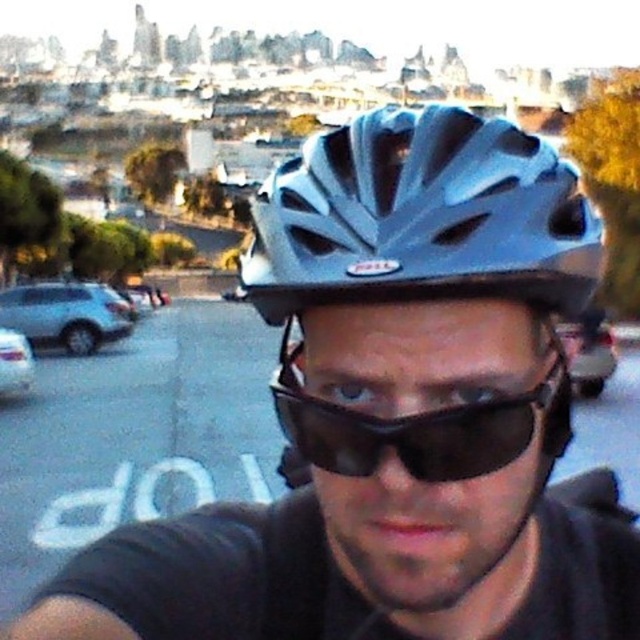
Question: Is matte gray helmet at center closer to the viewer compared to black matte sunglasses at center?

Choices:
 (A) no
 (B) yes

Answer: (B)

Question: Which point is closer to the camera taking this photo?

Choices:
 (A) (529, 432)
 (B) (563, 244)

Answer: (A)

Question: Which object appears farthest from the camera in this image?

Choices:
 (A) matte gray helmet at center
 (B) black matte sunglasses at center

Answer: (B)

Question: Considering the relative positions of matte gray helmet at center and black matte sunglasses at center in the image provided, where is matte gray helmet at center located with respect to black matte sunglasses at center?

Choices:
 (A) left
 (B) right

Answer: (A)

Question: Can you confirm if matte gray helmet at center is positioned below black matte sunglasses at center?

Choices:
 (A) no
 (B) yes

Answer: (A)